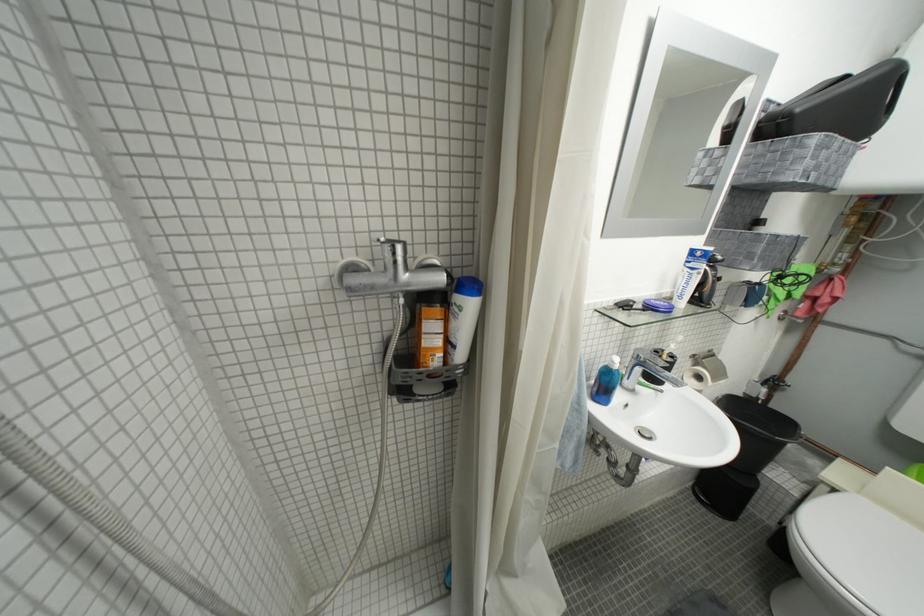
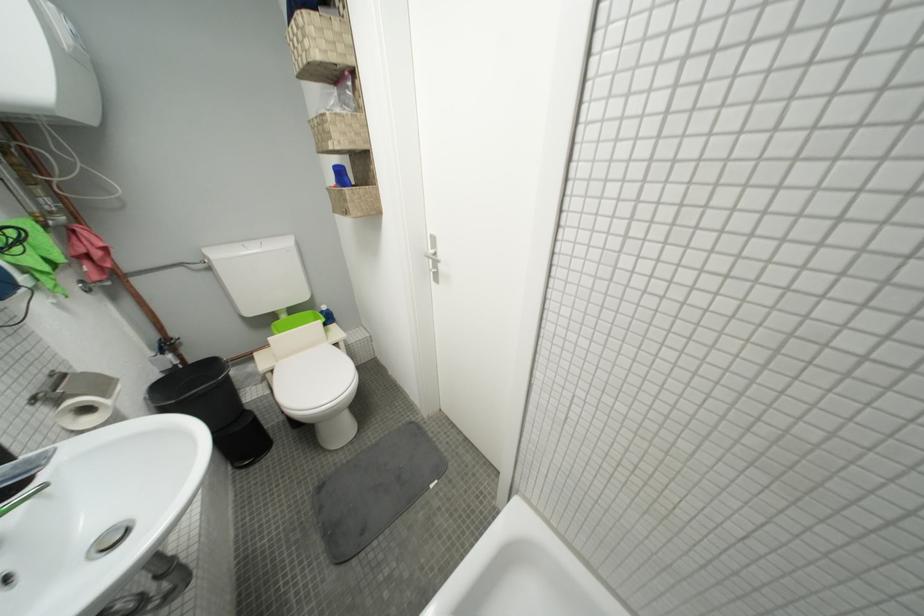
Locate, in the second image, the point that corresponds to point (723, 381) in the first image.

(113, 397)